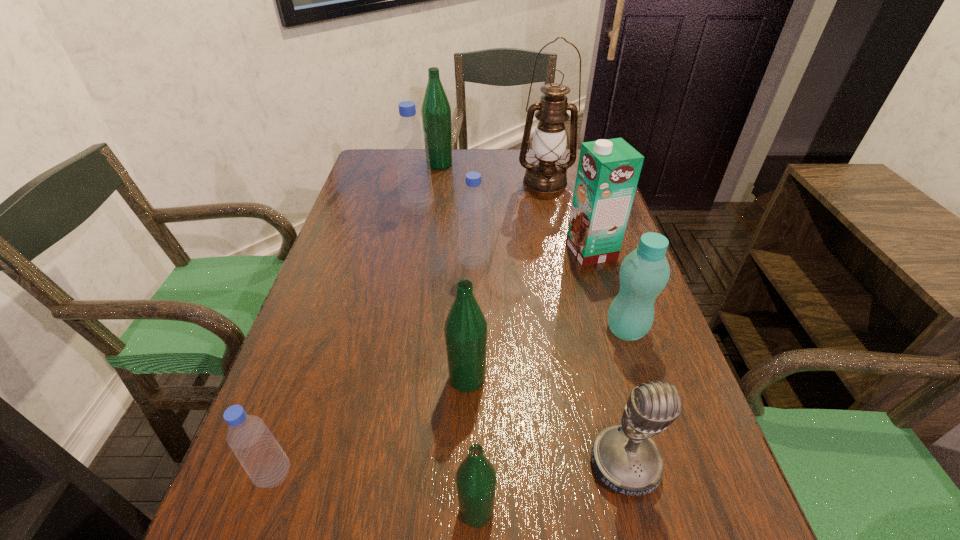
Image resolution: width=960 pixels, height=540 pixels. Identify the location of oil lamp. click(545, 175).

Find the location of a particular element. brown oil lamp is located at coordinates (545, 175).

Locate an element on the screen. the second blue bottle from right to left is located at coordinates (415, 186).

Locate an element on the screen. the farthest blue bottle is located at coordinates (415, 186).

This screenshot has width=960, height=540. Find the location of `the leftmost green bottle`. the leftmost green bottle is located at coordinates (436, 111).

Locate an element on the screen. The height and width of the screenshot is (540, 960). the farthest bottle is located at coordinates (436, 111).

The height and width of the screenshot is (540, 960). In order to click on carton in this screenshot , I will do `click(608, 171)`.

Identify the location of the second smallest blue bottle. (x=473, y=204).

This screenshot has width=960, height=540. What are the coordinates of `the second nearest blue bottle` in the screenshot? It's located at (473, 204).

The height and width of the screenshot is (540, 960). I want to click on the seventh farthest object, so click(465, 329).